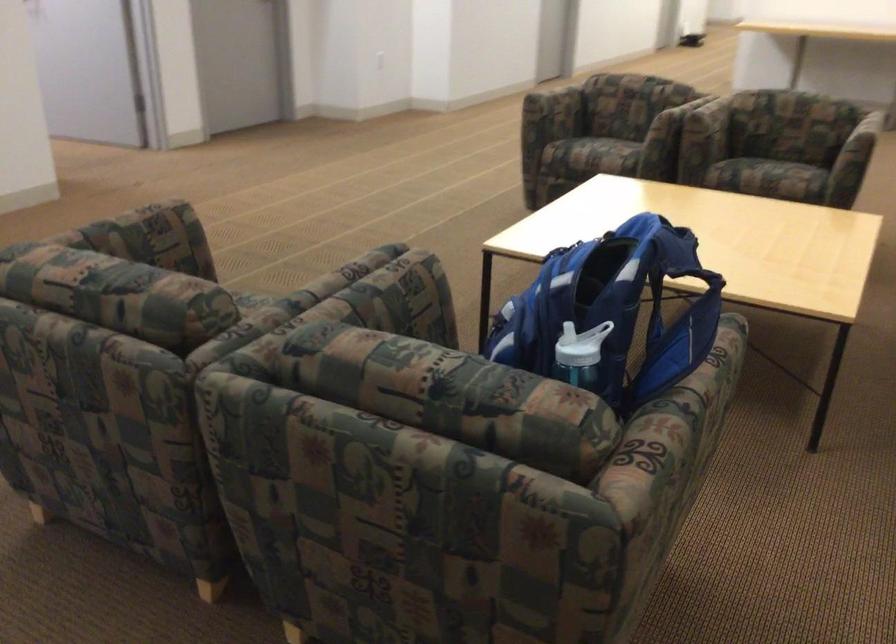
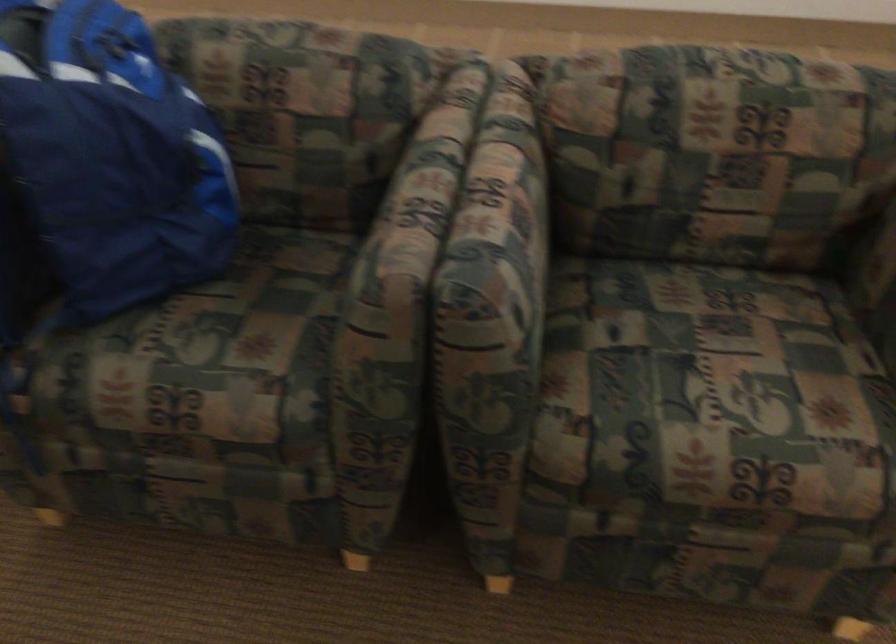
The point at (391, 267) is marked in the first image. Where is the corresponding point in the second image?

(412, 207)